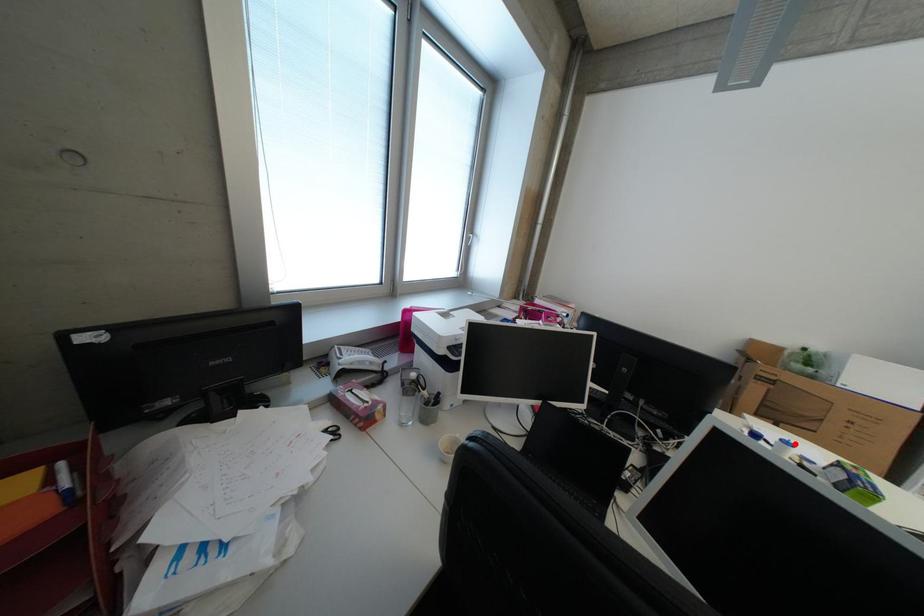
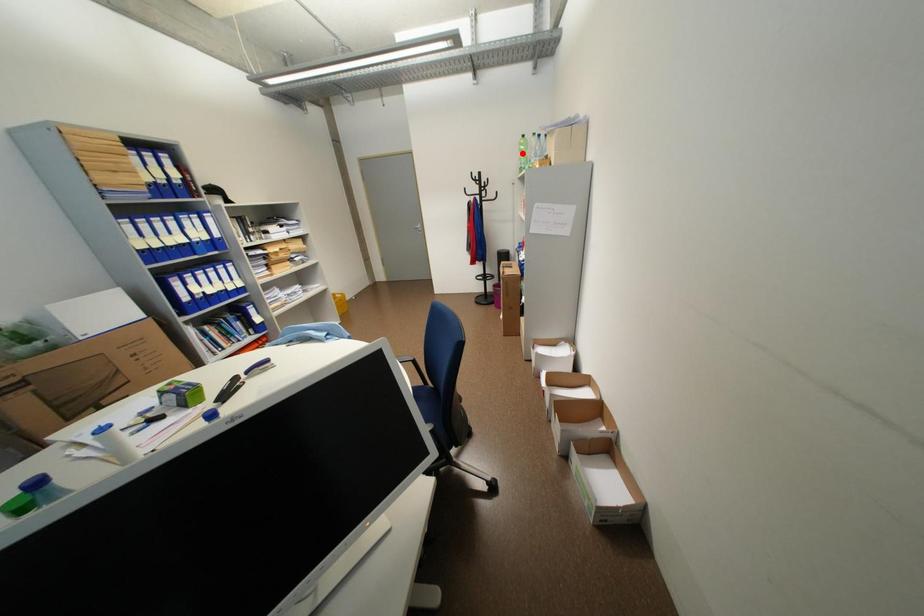
I am providing you with two images of the same scene from different viewpoints. A red point is marked on the first image and another point is marked on the second image. Are the points marked in image1 and image2 representing the same 3D position?

No